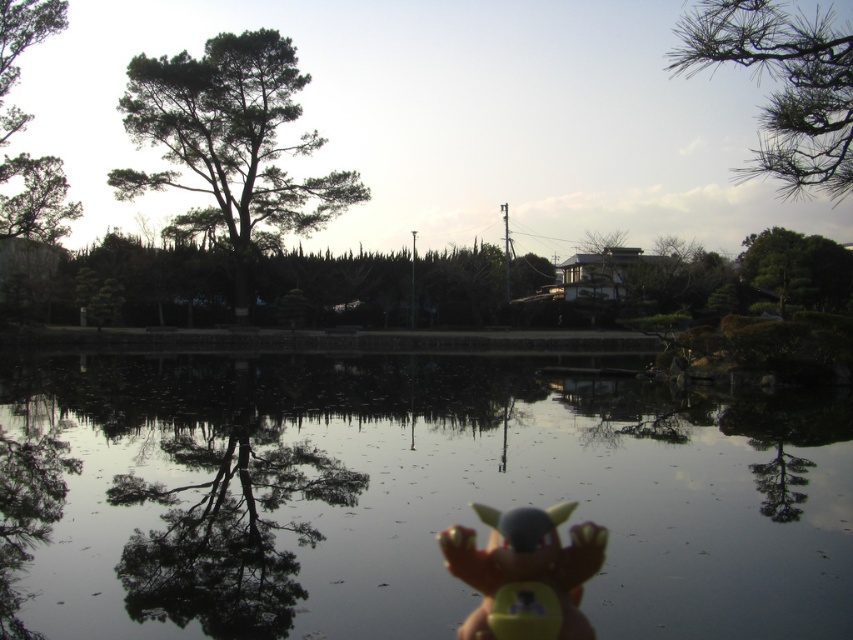
You are an artist planning to paint the scene. You need to decide which area to focus on first based on their sizes. Which object should you paint first, the transparent water at center or the green matte tree at upper left?

The transparent water at center has a larger width than the green matte tree at upper left, so you should paint the transparent water at center first to ensure proper scaling when adding the smaller green matte tree at upper left later.

You are standing in the garden and see the green leafy tree at upper left and the green matte tree at upper left. Which tree is closer to you?

The green leafy tree at upper left is closer to you because the green matte tree at upper left is behind it.